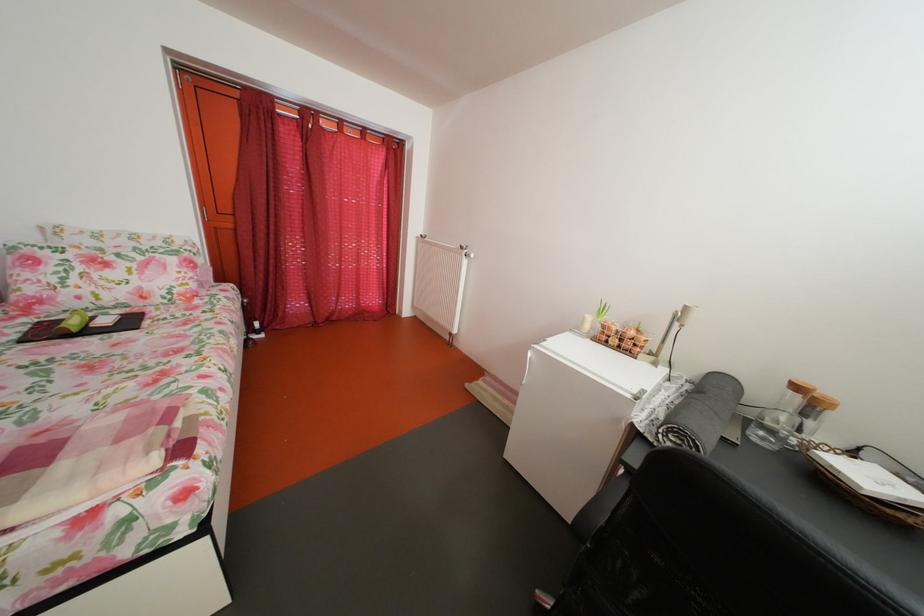
The image size is (924, 616). What do you see at coordinates (467, 252) in the screenshot?
I see `a radiator valve` at bounding box center [467, 252].